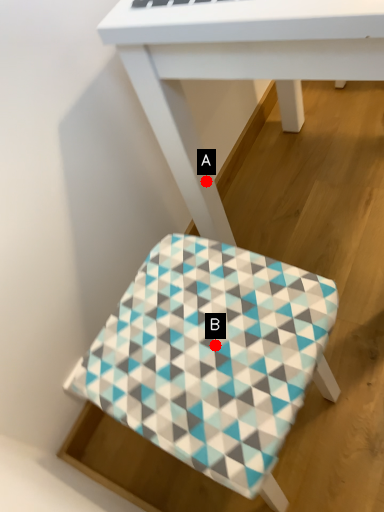
Question: Two points are circled on the image, labeled by A and B beside each circle. Which point is closer to the camera?

Choices:
 (A) A is closer
 (B) B is closer

Answer: (B)